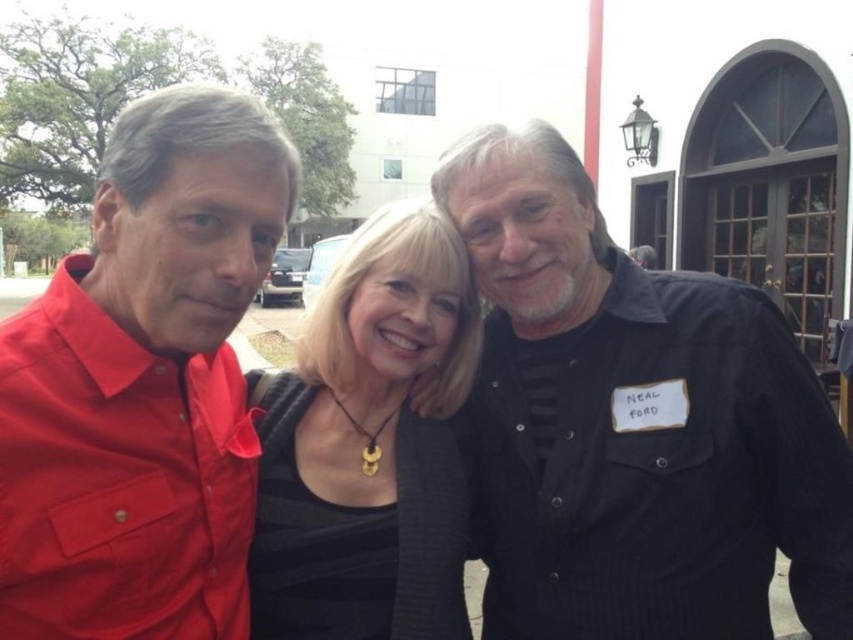
Between matte red shirt at left and black matte dress at center, which one appears on the right side from the viewer's perspective?

From the viewer's perspective, black matte dress at center appears more on the right side.

Can you confirm if matte red shirt at left is positioned to the right of black matte dress at center?

Incorrect, matte red shirt at left is not on the right side of black matte dress at center.

Which is behind, point (144, 433) or point (347, 621)?

Point (347, 621)

Image resolution: width=853 pixels, height=640 pixels. What are the coordinates of `matte red shirt at left` in the screenshot? It's located at (143, 385).

Is point (682, 476) positioned before point (398, 248)?

Yes.

The width and height of the screenshot is (853, 640). Find the location of `black textured shirt at center`. black textured shirt at center is located at coordinates (633, 424).

Identify the location of black textured shirt at center. (633, 424).

Locate an element on the screen. This screenshot has height=640, width=853. black textured shirt at center is located at coordinates (633, 424).

From the picture: Between black textured shirt at center and matte red shirt at left, which one is positioned higher?

matte red shirt at left is higher up.

You are a GUI agent. You are given a task and a screenshot of the screen. Output one action in this format:
    pyautogui.click(x=<x>, y=<y>)
    Task: Click on the black textured shirt at center
    This screenshot has height=640, width=853.
    Given the screenshot: What is the action you would take?
    pyautogui.click(x=633, y=424)

Locate an element on the screen. This screenshot has width=853, height=640. black textured shirt at center is located at coordinates (633, 424).